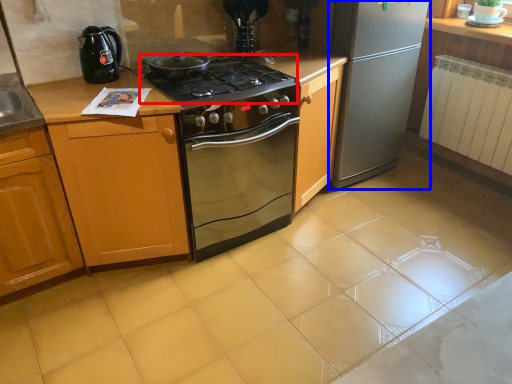
Question: Which point is closer to the camera, gas stove (highlighted by a red box) or refrigerator (highlighted by a blue box)?

Choices:
 (A) gas stove
 (B) refrigerator

Answer: (A)